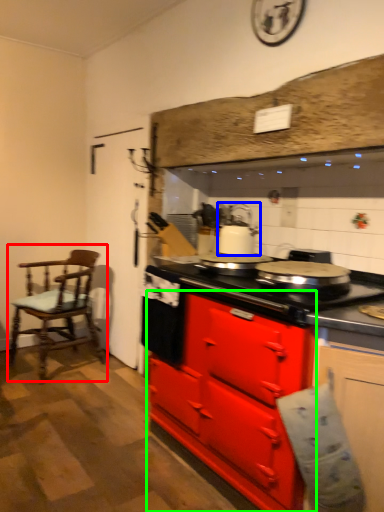
Question: Which object is positioned farthest from chair (highlighted by a red box)? Select from kitchen appliance (highlighted by a blue box) and cabinetry (highlighted by a green box).

Choices:
 (A) kitchen appliance
 (B) cabinetry

Answer: (B)